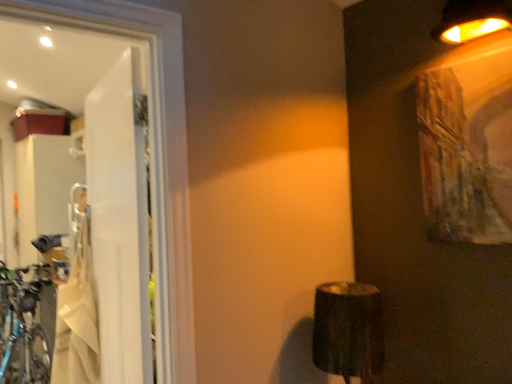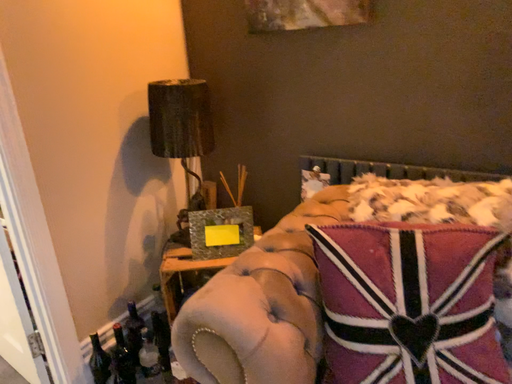
Question: Which way did the camera rotate in the video?

Choices:
 (A) rotated downward
 (B) rotated upward

Answer: (A)